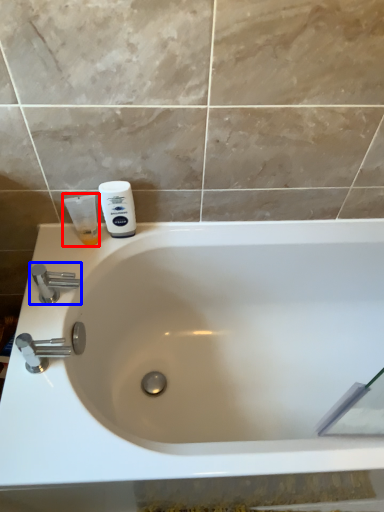
Question: Among these objects, which one is farthest to the camera, shaving cream (highlighted by a red box) or tap (highlighted by a blue box)?

Choices:
 (A) shaving cream
 (B) tap

Answer: (A)